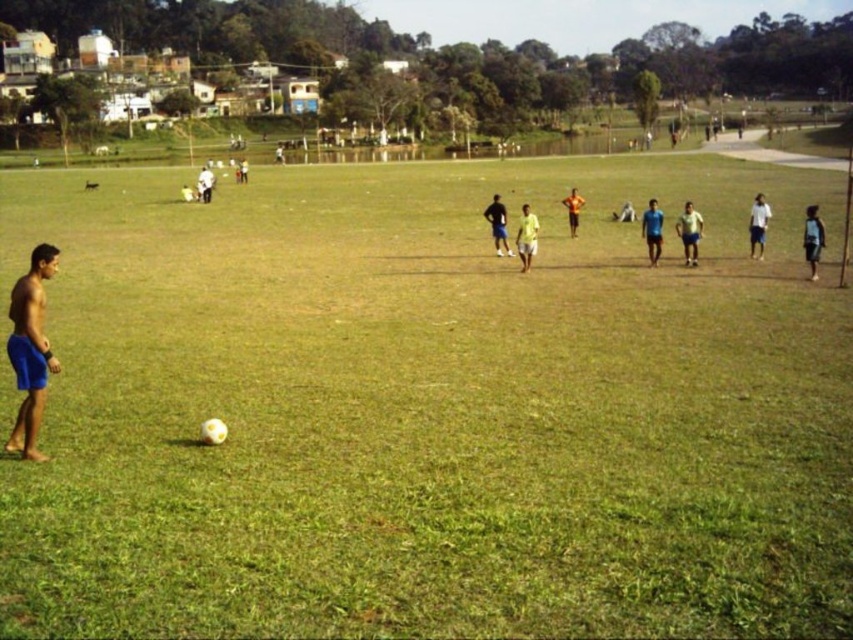
Question: Which of these objects is positioned farthest from the yellow fabric shirt at center?

Choices:
 (A) blue fabric shorts at left
 (B) white matte shirt at right

Answer: (A)

Question: Is blue shorts at center positioned behind light brown skin at center?

Choices:
 (A) yes
 (B) no

Answer: (B)

Question: Which object is farther from the camera taking this photo?

Choices:
 (A) blue fabric shorts at left
 (B) yellow fabric shirt at center
 (C) dark blue shorts at center
 (D) blue shorts at center

Answer: (C)

Question: Is white matte shirt at right closer to camera compared to dark blue shorts at center?

Choices:
 (A) no
 (B) yes

Answer: (B)

Question: Can you confirm if dark blue shorts at center is positioned below light brown skin at center?

Choices:
 (A) no
 (B) yes

Answer: (B)

Question: Which of the following is the farthest from the observer?

Choices:
 (A) blue shorts at center
 (B) yellow fabric shirt at center

Answer: (B)